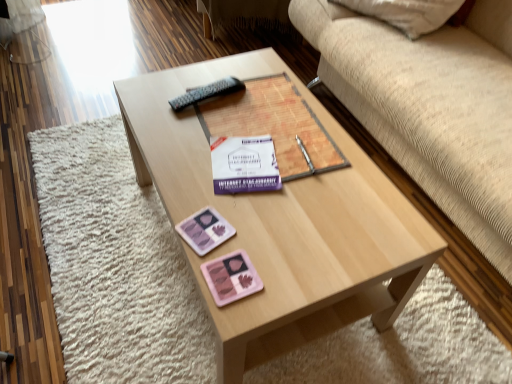
At what (x,y) coordinates should I click in order to perform the action: click on free space to the left of white paper at center. Please return your answer as a coordinate pair (x, y). Looking at the image, I should click on (182, 161).